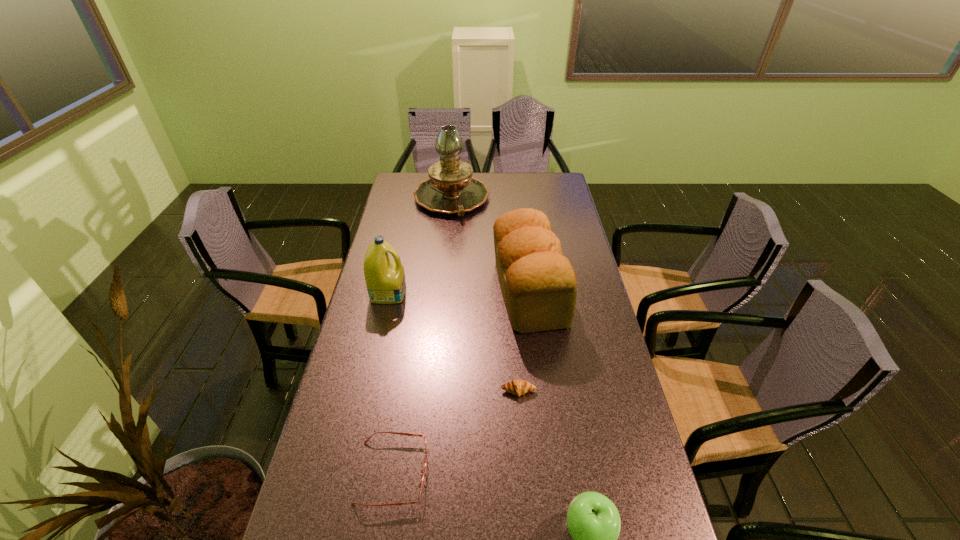
This screenshot has height=540, width=960. In order to click on vacant space at the right edge of the desktop in this screenshot , I will do `click(541, 208)`.

In the image, there is a desktop. Identify the location of vacant area at the far left corner. (402, 178).

At what (x,y) coordinates should I click in order to perform the action: click on vacant space at the far right corner of the desktop. Please return your answer as a coordinate pair (x, y). The image size is (960, 540). Looking at the image, I should click on (569, 198).

This screenshot has width=960, height=540. Identify the location of free spot between the bread and the fifth tallest object. (461, 382).

Find the location of `free point between the oil lamp and the third nearest object`. free point between the oil lamp and the third nearest object is located at coordinates (485, 295).

At what (x,y) coordinates should I click in order to perform the action: click on vacant point located between the detergent and the spectacles. Please return your answer as a coordinate pair (x, y). Looking at the image, I should click on (391, 382).

Find the location of a particular element. The image size is (960, 540). empty space between the farthest object and the second shortest object is located at coordinates tap(422, 336).

Identify the location of blank region between the third nearest object and the spectacles. The width and height of the screenshot is (960, 540). (455, 431).

You are a GUI agent. You are given a task and a screenshot of the screen. Output one action in this format:
    pyautogui.click(x=<x>, y=<y>)
    Task: Click on the empty space between the bread and the spectacles
    
    Given the screenshot: What is the action you would take?
    pyautogui.click(x=461, y=382)

At what (x,y) coordinates should I click in order to perform the action: click on free space between the pastry and the detergent. Please return your answer as a coordinate pair (x, y). The width and height of the screenshot is (960, 540). Looking at the image, I should click on (453, 342).